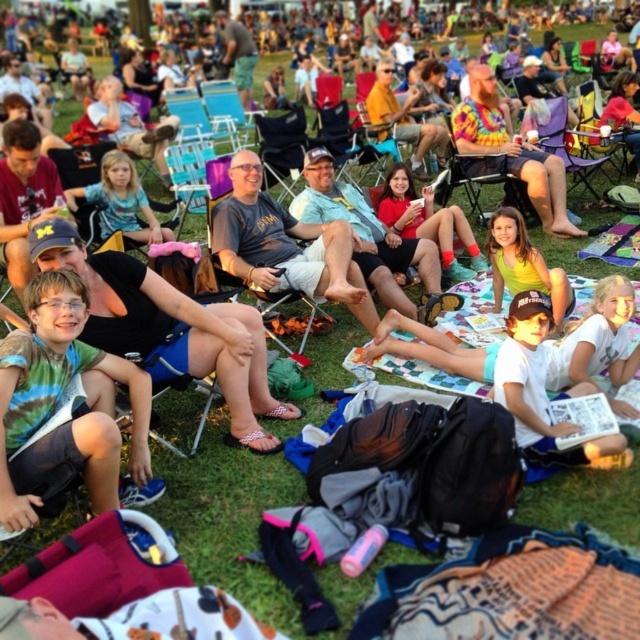
Looking at this image, you are standing at the edge of the gathering and want to locate the matte blue shirt at center. According to the coordinates provided, where would you look relative to your position?

The matte blue shirt at center is located at point 0.369 along the horizontal axis and 0.573 along the vertical axis from the bottom left corner of the image. This places it slightly to the right and above the center point.